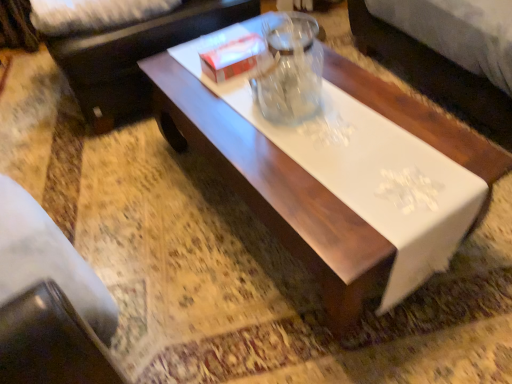
You are a GUI agent. You are given a task and a screenshot of the screen. Output one action in this format:
    pyautogui.click(x=<x>, y=<y>)
    Task: Click on the free space in front of white cardboard box at center
    The image size is (512, 384).
    Given the screenshot: What is the action you would take?
    pyautogui.click(x=224, y=98)